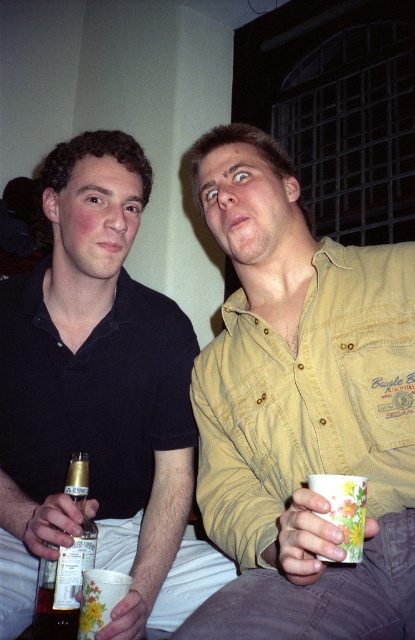
You are at a party and see the matte black shirt at left and the gold foil beer bottle at lower left. Which object is taller?

The matte black shirt at left is taller than the gold foil beer bottle at lower left.

Based on the photo, you are at a party and see the yellow cotton shirt at upper right and the gold foil beer bottle at lower left. Which object is positioned more to the right side of the scene?

The yellow cotton shirt at upper right is positioned more to the right side of the scene than the gold foil beer bottle at lower left.

You are taking a photo of two people sitting at a social gathering. You notice two points marked in the image at coordinates point (163,564) and point (77,500). Which point is closer to the camera?

Point (163,564) is further to the camera than point (77,500), so the closer point to the camera is point (77,500).